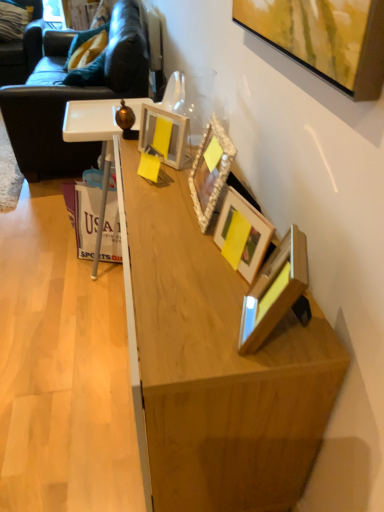
I want to click on vacant space positioned to the left of wooden picture frame at center, which ranks as the third picture frame in back-to-front order, so click(x=183, y=261).